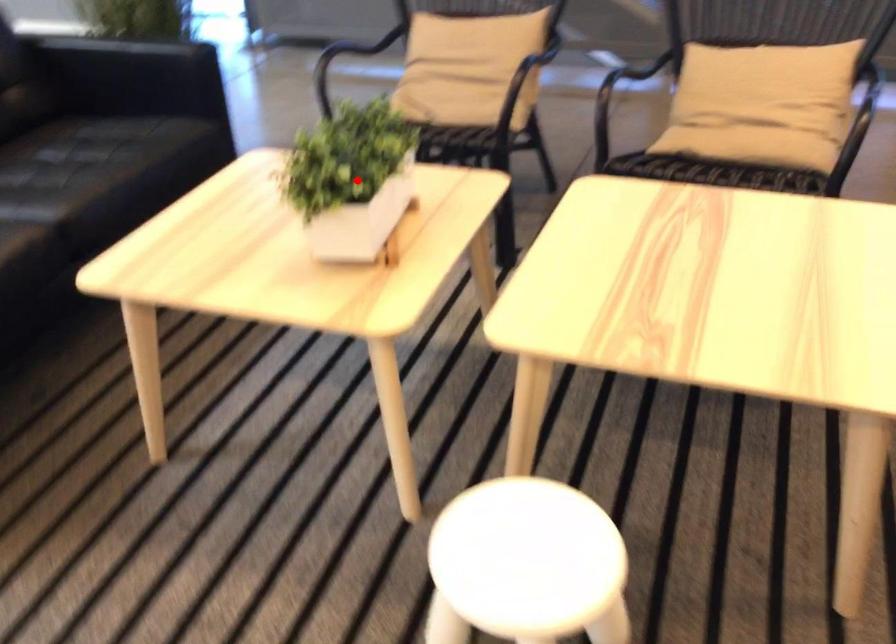
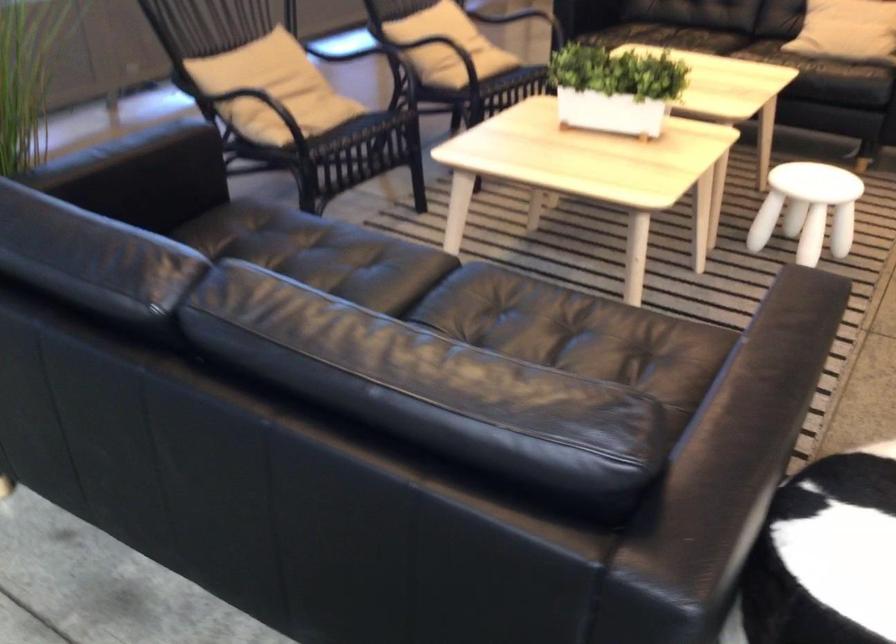
The point at the highlighted location is marked in the first image. Where is the corresponding point in the second image?

(615, 88)